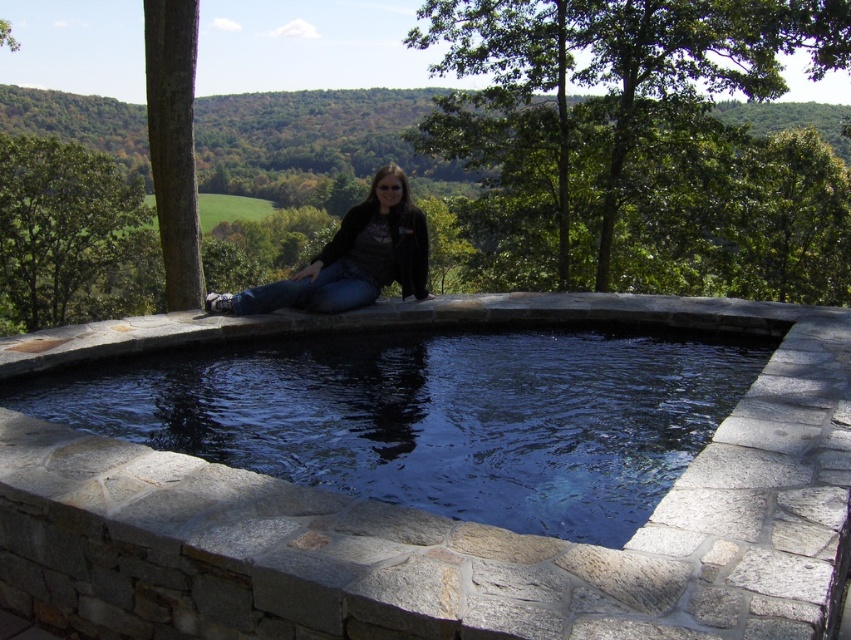
You are a photographer trying to capture the scene of the woman by the hot tub. To ensure the dark stone pool at center and denim jeans at center are both clearly visible in the photo, where should you position your camera relative to the woman?

The dark stone pool at center is located below denim jeans at center, so positioning the camera slightly above the woman will ensure both the dark stone pool at center and denim jeans at center are in clear view.